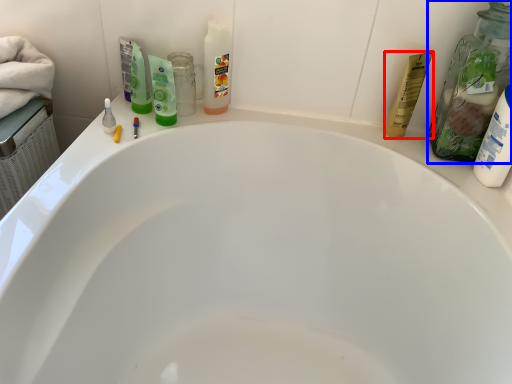
Question: Among these objects, which one is nearest to the camera, toiletry (highlighted by a red box) or cleaning product (highlighted by a blue box)?

Choices:
 (A) toiletry
 (B) cleaning product

Answer: (B)